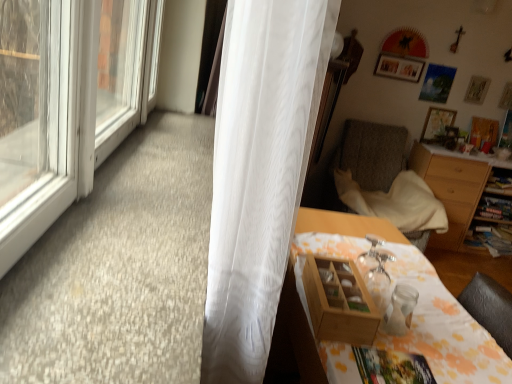
Question: From the image's perspective, is white sheer curtain at left under wooden picture frame at upper right, which appears as the third picture frame when viewed from the right?

Choices:
 (A) no
 (B) yes

Answer: (B)

Question: Is white sheer curtain at left shorter than wooden picture frame at upper right, which is counted as the 2th picture frame, starting from the left?

Choices:
 (A) no
 (B) yes

Answer: (A)

Question: Does white sheer curtain at left have a larger size compared to wooden picture frame at upper right, which appears as the third picture frame when viewed from the right?

Choices:
 (A) no
 (B) yes

Answer: (B)

Question: Is white sheer curtain at left to the left of wooden picture frame at upper right, which is counted as the 2th picture frame, starting from the left, from the viewer's perspective?

Choices:
 (A) yes
 (B) no

Answer: (A)

Question: Is wooden picture frame at upper right, which appears as the third picture frame when viewed from the right, located within white sheer curtain at left?

Choices:
 (A) no
 (B) yes

Answer: (A)

Question: Choose the correct answer: Is wooden box at lower right inside wooden picture frame at upper right, which appears as the third picture frame when viewed from the right, or outside it?

Choices:
 (A) outside
 (B) inside

Answer: (A)

Question: Considering the relative positions of wooden box at lower right and wooden picture frame at upper right, which is counted as the 2th picture frame, starting from the left, in the image provided, is wooden box at lower right to the left or to the right of wooden picture frame at upper right, which is counted as the 2th picture frame, starting from the left,?

Choices:
 (A) left
 (B) right

Answer: (A)

Question: Is wooden box at lower right wider or thinner than wooden picture frame at upper right, which is counted as the 2th picture frame, starting from the left?

Choices:
 (A) thin
 (B) wide

Answer: (B)

Question: Considering the positions of point (339, 263) and point (454, 115), is point (339, 263) closer or farther from the camera than point (454, 115)?

Choices:
 (A) closer
 (B) farther

Answer: (A)

Question: From the image's perspective, is wooden picture frame at upper right, the third picture frame when ordered from left to right, positioned above or below wooden box at lower right?

Choices:
 (A) above
 (B) below

Answer: (A)

Question: From their relative heights in the image, would you say wooden picture frame at upper right, placed as the second picture frame when sorted from right to left, is taller or shorter than wooden box at lower right?

Choices:
 (A) tall
 (B) short

Answer: (A)

Question: Considering their positions, is wooden picture frame at upper right, the third picture frame when ordered from left to right, located in front of or behind wooden box at lower right?

Choices:
 (A) front
 (B) behind

Answer: (B)

Question: Would you say wooden picture frame at upper right, the third picture frame when ordered from left to right, is to the left or to the right of wooden box at lower right in the picture?

Choices:
 (A) right
 (B) left

Answer: (A)

Question: Looking at their shapes, would you say wooden photo frame at upper center, which is the first picture frame from left to right, is wider or thinner than white sheer curtain at left?

Choices:
 (A) wide
 (B) thin

Answer: (B)

Question: Relative to white sheer curtain at left, is wooden photo frame at upper center, which is the first picture frame from left to right, in front or behind?

Choices:
 (A) behind
 (B) front

Answer: (A)